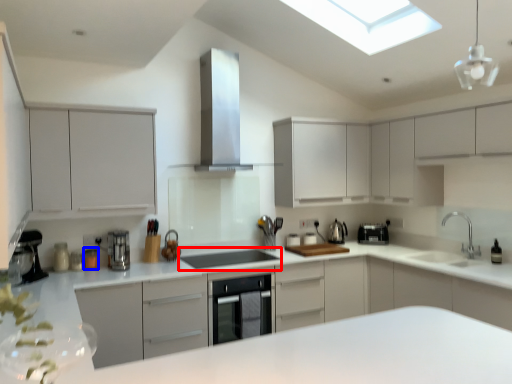
Question: Among these objects, which one is nearest to the camera, appliance (highlighted by a red box) or appliance (highlighted by a blue box)?

Choices:
 (A) appliance
 (B) appliance

Answer: (A)